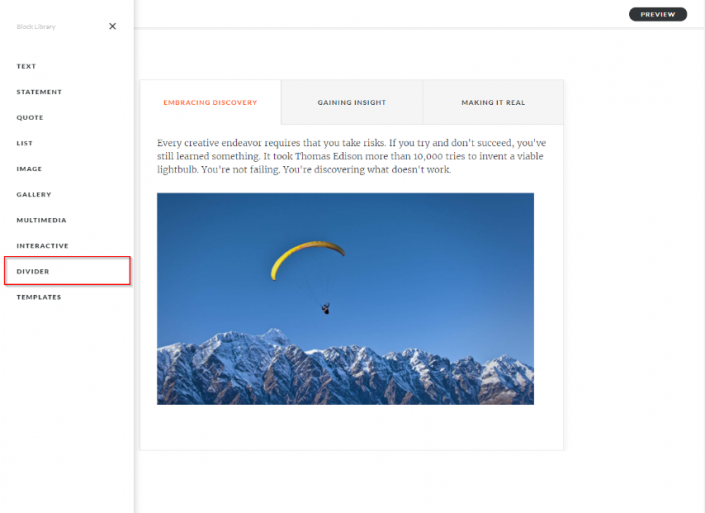
The width and height of the screenshot is (705, 513). I want to click on cable, so click(307, 297), click(318, 290), click(326, 286), click(333, 283).